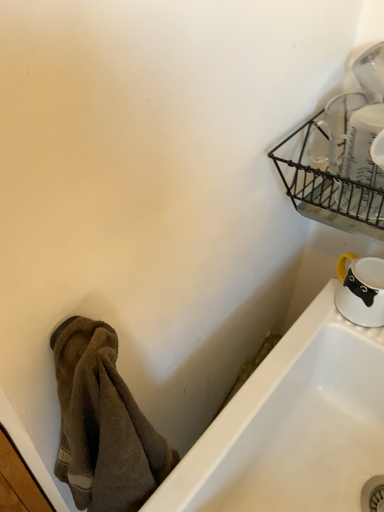
How much space does white glossy mug at lower right, the 2th tableware when ordered from top to bottom, occupy horizontally?

3.61 inches.

Locate an element on the screen. The height and width of the screenshot is (512, 384). white glossy mug at lower right, which is the 1th tableware in back-to-front order is located at coordinates [x=361, y=290].

Is black wire basket at upper right bigger than white glossy bathtub at lower right?

No.

Would you say white glossy bathtub at lower right is part of black wire basket at upper right's contents?

No, white glossy bathtub at lower right is not surrounded by black wire basket at upper right.

Is black wire basket at upper right positioned far away from white glossy bathtub at lower right?

They are positioned close to each other.

From a real-world perspective, is clear glass measuring cups at upper right, the first tableware in the top-to-bottom sequence, below white glossy bathtub at lower right?

No.

Is point (316, 135) less distant than point (208, 462)?

No, (316, 135) is behind (208, 462).

At what (x,y) coordinates should I click in order to perform the action: click on tableware that appears in front of the white glossy bathtub at lower right. Please return your answer as a coordinate pair (x, y). The height and width of the screenshot is (512, 384). Looking at the image, I should click on (336, 129).

Consider the image. From the image's perspective, which object appears higher, clear glass measuring cups at upper right, which appears as the first tableware when viewed from the front, or brown fuzzy towel at lower left?

clear glass measuring cups at upper right, which appears as the first tableware when viewed from the front, from the image's perspective.

Considering the positions of points (336, 148) and (64, 323), is point (336, 148) closer to camera compared to point (64, 323)?

No, it is not.

Considering the relative sizes of clear glass measuring cups at upper right, the first tableware in the top-to-bottom sequence, and brown fuzzy towel at lower left in the image provided, is clear glass measuring cups at upper right, the first tableware in the top-to-bottom sequence, bigger than brown fuzzy towel at lower left?

No, clear glass measuring cups at upper right, the first tableware in the top-to-bottom sequence, is not bigger than brown fuzzy towel at lower left.

Is clear glass measuring cups at upper right, which ranks as the 2th tableware in bottom-to-top order, inside the boundaries of brown fuzzy towel at lower left, or outside?

The correct answer is: outside.

This screenshot has height=512, width=384. I want to click on towel/napkin that appears below the black wire basket at upper right (from a real-world perspective), so click(103, 424).

Are black wire basket at upper right and brown fuzzy towel at lower left located far from each other?

Actually, black wire basket at upper right and brown fuzzy towel at lower left are a little close together.

Based on the photo, how many degrees apart are the facing directions of black wire basket at upper right and brown fuzzy towel at lower left?

87 degrees.

Looking at their sizes, would you say clear glass measuring cups at upper right, which ranks as the 2th tableware in bottom-to-top order, is wider or thinner than white glossy mug at lower right, which is the 1th tableware in back-to-front order?

Considering their sizes, clear glass measuring cups at upper right, which ranks as the 2th tableware in bottom-to-top order, looks broader than white glossy mug at lower right, which is the 1th tableware in back-to-front order.

Which object is closer to the camera, clear glass measuring cups at upper right, the first tableware in the top-to-bottom sequence, or white glossy mug at lower right, acting as the first tableware starting from the bottom?

clear glass measuring cups at upper right, the first tableware in the top-to-bottom sequence, is closer to the camera.

Is clear glass measuring cups at upper right, which ranks as the 2th tableware in back-to-front order, to the left or to the right of white glossy mug at lower right, the 2th tableware when ordered from top to bottom, in the image?

Based on their positions, clear glass measuring cups at upper right, which ranks as the 2th tableware in back-to-front order, is located to the left of white glossy mug at lower right, the 2th tableware when ordered from top to bottom.

From the picture: Could you tell me if brown fuzzy towel at lower left is facing white glossy mug at lower right, arranged as the 2th tableware when viewed from the front?

No.

You are a GUI agent. You are given a task and a screenshot of the screen. Output one action in this format:
    pyautogui.click(x=<x>, y=<y>)
    Task: Click on the tableware that is the 2nd one when counting backward from the brown fuzzy towel at lower left
    This screenshot has height=512, width=384.
    Given the screenshot: What is the action you would take?
    pyautogui.click(x=361, y=290)

Can you see brown fuzzy towel at lower left touching white glossy mug at lower right, arranged as the 2th tableware when viewed from the front?

No, brown fuzzy towel at lower left is not touching white glossy mug at lower right, arranged as the 2th tableware when viewed from the front.

Who is bigger, brown fuzzy towel at lower left or white glossy mug at lower right, arranged as the 2th tableware when viewed from the front?

Bigger between the two is brown fuzzy towel at lower left.

Is white glossy bathtub at lower right oriented away from brown fuzzy towel at lower left?

No.

Would you say white glossy bathtub at lower right is to the left or to the right of brown fuzzy towel at lower left in the picture?

In the image, white glossy bathtub at lower right appears on the right side of brown fuzzy towel at lower left.

From the image's perspective, which is below, white glossy bathtub at lower right or brown fuzzy towel at lower left?

white glossy bathtub at lower right is shown below in the image.

Does white glossy bathtub at lower right lie in front of brown fuzzy towel at lower left?

No, it is not.

You are a GUI agent. You are given a task and a screenshot of the screen. Output one action in this format:
    pyautogui.click(x=<x>, y=<y>)
    Task: Click on the bathtub that appears below the black wire basket at upper right (from the image's perspective)
    This screenshot has width=384, height=512.
    Given the screenshot: What is the action you would take?
    pyautogui.click(x=293, y=425)

The height and width of the screenshot is (512, 384). In the image, there is a clear glass measuring cups at upper right, which appears as the first tableware when viewed from the front. Find the location of `bathtub below it (from a real-world perspective)`. bathtub below it (from a real-world perspective) is located at coordinates (293, 425).

Considering their positions, is white glossy mug at lower right, which is the 1th tableware in back-to-front order, positioned closer to black wire basket at upper right than brown fuzzy towel at lower left?

Based on the image, white glossy mug at lower right, which is the 1th tableware in back-to-front order, appears to be nearer to black wire basket at upper right.

From the image, which object appears to be nearer to white glossy mug at lower right, arranged as the 2th tableware when viewed from the front, clear glass measuring cups at upper right, which appears as the first tableware when viewed from the front, or white glossy bathtub at lower right?

Among the two, white glossy bathtub at lower right is located nearer to white glossy mug at lower right, arranged as the 2th tableware when viewed from the front.

Based on their spatial positions, is brown fuzzy towel at lower left or black wire basket at upper right closer to white glossy mug at lower right, which is the 1th tableware in back-to-front order?

black wire basket at upper right is closer to white glossy mug at lower right, which is the 1th tableware in back-to-front order.

Looking at the image, which one is located further to white glossy bathtub at lower right, black wire basket at upper right or white glossy mug at lower right, arranged as the 2th tableware when viewed from the front?

The object further to white glossy bathtub at lower right is black wire basket at upper right.

In the scene shown: When comparing their distances from white glossy bathtub at lower right, does white glossy mug at lower right, which is the 1th tableware in back-to-front order, or black wire basket at upper right seem closer?

white glossy mug at lower right, which is the 1th tableware in back-to-front order.

Looking at this image, based on their spatial positions, is black wire basket at upper right or clear glass measuring cups at upper right, the first tableware in the top-to-bottom sequence, closer to brown fuzzy towel at lower left?

Among the two, black wire basket at upper right is located nearer to brown fuzzy towel at lower left.

Looking at the image, which one is located closer to brown fuzzy towel at lower left, clear glass measuring cups at upper right, which ranks as the 2th tableware in back-to-front order, or white glossy bathtub at lower right?

Among the two, white glossy bathtub at lower right is located nearer to brown fuzzy towel at lower left.

When comparing their distances from clear glass measuring cups at upper right, which appears as the first tableware when viewed from the front, does black wire basket at upper right or white glossy bathtub at lower right seem further?

white glossy bathtub at lower right is further to clear glass measuring cups at upper right, which appears as the first tableware when viewed from the front.

Locate an element on the screen. basket located between brown fuzzy towel at lower left and white glossy mug at lower right, arranged as the 2th tableware when viewed from the front, in the left-right direction is located at coordinates (327, 183).

Image resolution: width=384 pixels, height=512 pixels. Find the location of `tableware located between brown fuzzy towel at lower left and white glossy mug at lower right, the 2th tableware when ordered from top to bottom, in the left-right direction`. tableware located between brown fuzzy towel at lower left and white glossy mug at lower right, the 2th tableware when ordered from top to bottom, in the left-right direction is located at coordinates (336, 129).

Identify the location of tableware that lies between clear glass measuring cups at upper right, which ranks as the 2th tableware in back-to-front order, and white glossy bathtub at lower right from top to bottom. Image resolution: width=384 pixels, height=512 pixels. (361, 290).

Identify the location of tableware between black wire basket at upper right and white glossy mug at lower right, which is the 1th tableware in back-to-front order, in the vertical direction. This screenshot has height=512, width=384. (336, 129).